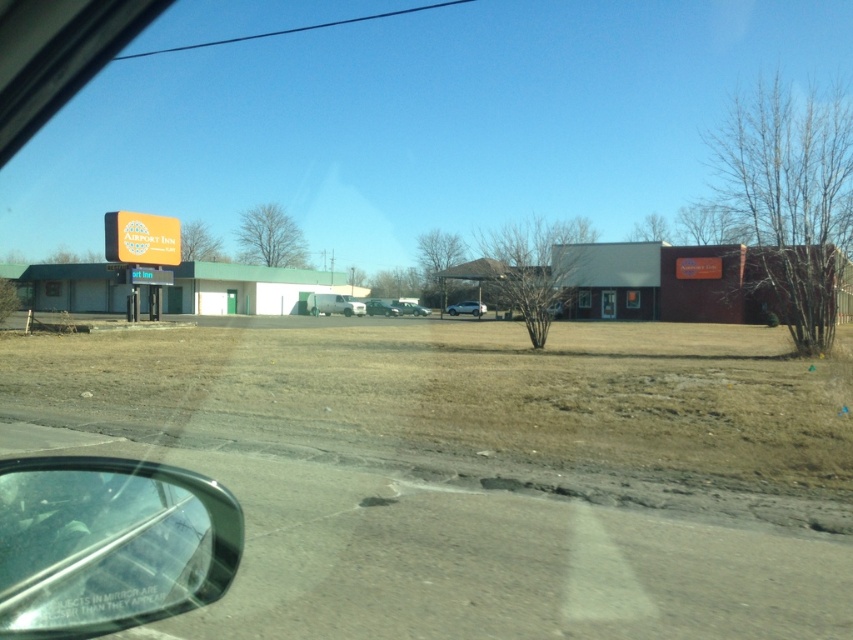
Question: Which point is closer to the camera?

Choices:
 (A) transparent glass car window at lower left
 (B) shiny black sedan at center
 (C) silver metallic car at center

Answer: (A)

Question: Which point is farther to the camera?

Choices:
 (A) shiny black sedan at center
 (B) metallic silver car at center
 (C) transparent glass car window at lower left

Answer: (B)

Question: Which point is farther from the camera taking this photo?

Choices:
 (A) (108, 531)
 (B) (189, 365)
 (C) (451, 314)
 (D) (415, 314)

Answer: (D)

Question: Is transparent glass car window at lower left thinner than white matte van at center?

Choices:
 (A) no
 (B) yes

Answer: (B)

Question: Can you confirm if brown dirt field at center is thinner than metallic silver car at center?

Choices:
 (A) yes
 (B) no

Answer: (B)

Question: Can you confirm if white matte van at center is thinner than silver metallic car at center?

Choices:
 (A) yes
 (B) no

Answer: (B)